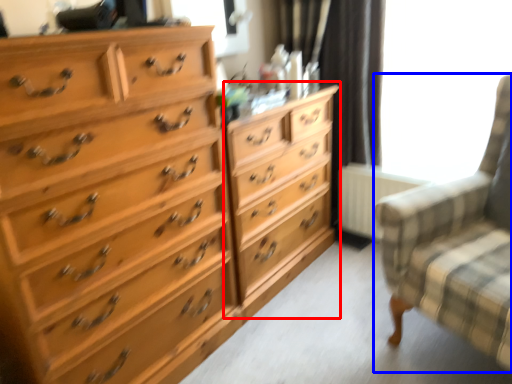
Question: Which object is closer to the camera taking this photo, dresser (highlighted by a red box) or rocking chair (highlighted by a blue box)?

Choices:
 (A) dresser
 (B) rocking chair

Answer: (B)